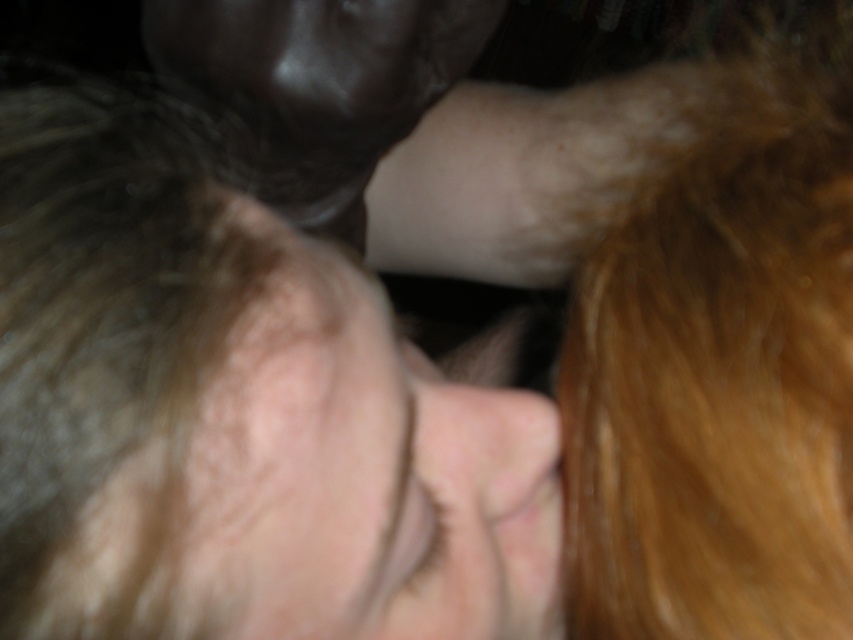
Question: Estimate the real-world distances between objects in this image. Which object is closer to the blonde silky hair at right?

Choices:
 (A) pink flesh at center
 (B) smooth skin face at center

Answer: (A)

Question: Is smooth skin face at center wider than blonde silky hair at right?

Choices:
 (A) no
 (B) yes

Answer: (B)

Question: Among these points, which one is nearest to the camera?

Choices:
 (A) (764, 97)
 (B) (398, 625)
 (C) (532, 426)

Answer: (B)

Question: Can you confirm if blonde silky hair at right is positioned to the right of pale skin at center?

Choices:
 (A) yes
 (B) no

Answer: (A)

Question: Can you confirm if pale skin at center is positioned to the right of pink flesh at center?

Choices:
 (A) no
 (B) yes

Answer: (A)

Question: Which of these objects is positioned closest to the pale skin at center?

Choices:
 (A) blonde silky hair at right
 (B) smooth skin face at center
 (C) pink flesh at center

Answer: (B)